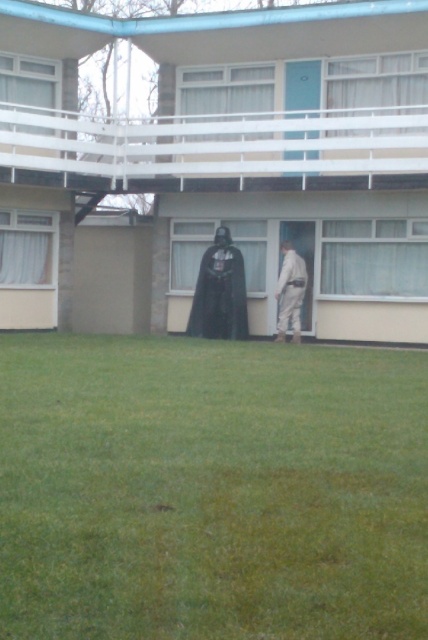
Who is positioned more to the right, black matte cloak at center or white fabric pants at lower center?

From the viewer's perspective, white fabric pants at lower center appears more on the right side.

Is point (222, 264) positioned behind point (297, 268)?

Yes.

I want to click on black matte cloak at center, so click(x=219, y=292).

Can you confirm if green grass at lower center is positioned above black matte cloak at center?

Actually, green grass at lower center is below black matte cloak at center.

Is green grass at lower center to the right of black matte cloak at center from the viewer's perspective?

No, green grass at lower center is not to the right of black matte cloak at center.

What do you see at coordinates (211, 490) in the screenshot? I see `green grass at lower center` at bounding box center [211, 490].

The image size is (428, 640). Identify the location of green grass at lower center. (211, 490).

Is green grass at lower center wider than white fabric pants at lower center?

Indeed, green grass at lower center has a greater width compared to white fabric pants at lower center.

Between point (366, 566) and point (290, 268), which one is positioned behind?

Positioned behind is point (290, 268).

Does point (17, 600) lie behind point (293, 252)?

No, (17, 600) is closer to viewer.

Find the location of a particular element. green grass at lower center is located at coordinates (211, 490).